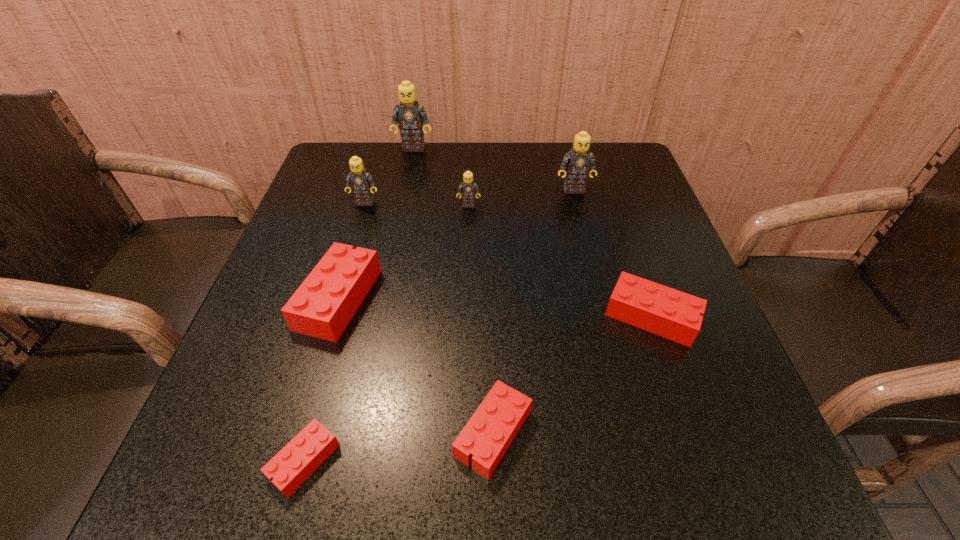
Find the location of `free point between the fifth tallest Lego and the sixth tallest object`. free point between the fifth tallest Lego and the sixth tallest object is located at coordinates (495, 308).

Identify the location of vacant area that lies between the second red Lego from right to left and the shortest object. (398, 447).

Identify the location of object that is the second closest to the rightmost tan Lego. This screenshot has height=540, width=960. (664, 311).

Locate an element on the screen. the second closest object to the third tallest Lego is located at coordinates (323, 305).

Locate which Lego is the fifth closest to the fifth tallest Lego. Please provide its 2D coordinates. Your answer should be formatted as a tuple, i.e. [(x, y)], where the tuple contains the x and y coordinates of a point satisfying the conditions above.

[(664, 311)]

Find the location of a particular element. The width and height of the screenshot is (960, 540). Lego object that ranks as the fourth closest to the fourth shortest Lego is located at coordinates (469, 189).

The height and width of the screenshot is (540, 960). I want to click on tan Lego that can be found as the third closest to the rightmost red Lego, so click(361, 182).

Identify which tan Lego is located as the nearest to the shortest object. Please provide its 2D coordinates. Your answer should be formatted as a tuple, i.e. [(x, y)], where the tuple contains the x and y coordinates of a point satisfying the conditions above.

[(361, 182)]

The height and width of the screenshot is (540, 960). Find the location of `the closest red Lego relative to the sixth tallest Lego`. the closest red Lego relative to the sixth tallest Lego is located at coordinates (487, 435).

The image size is (960, 540). I want to click on the closest red Lego relative to the biggest tan Lego, so click(x=323, y=305).